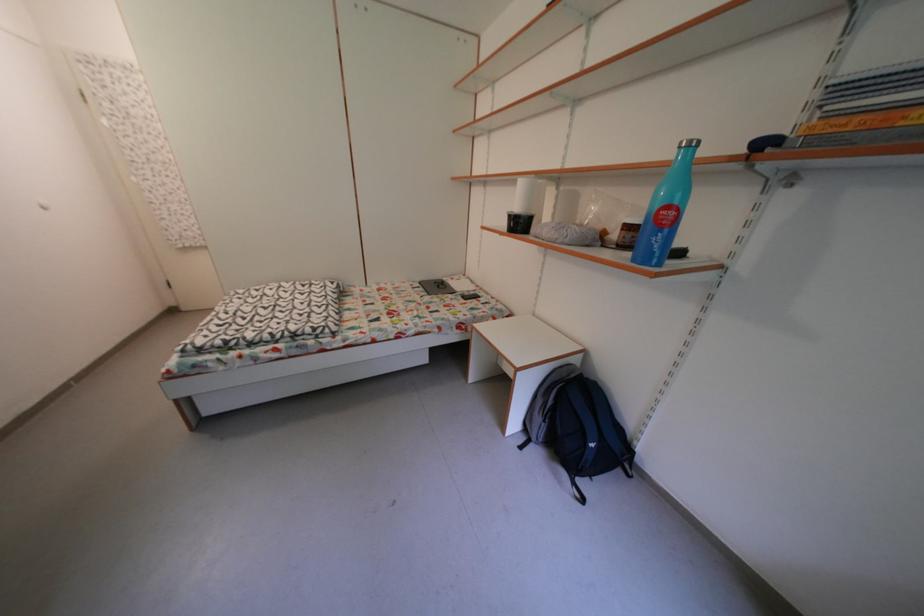
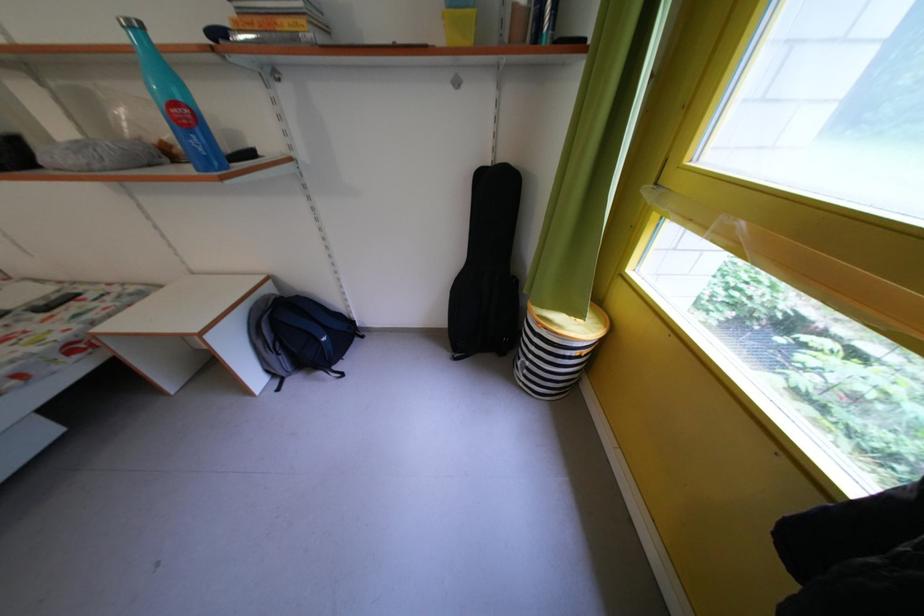
Where in the second image is the point corresponding to (586,367) from the first image?

(278, 296)